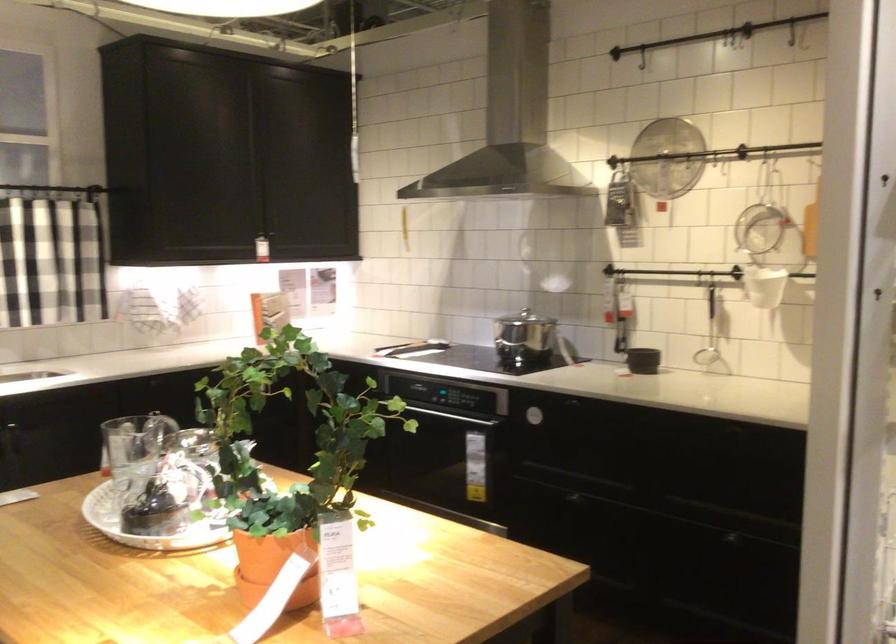
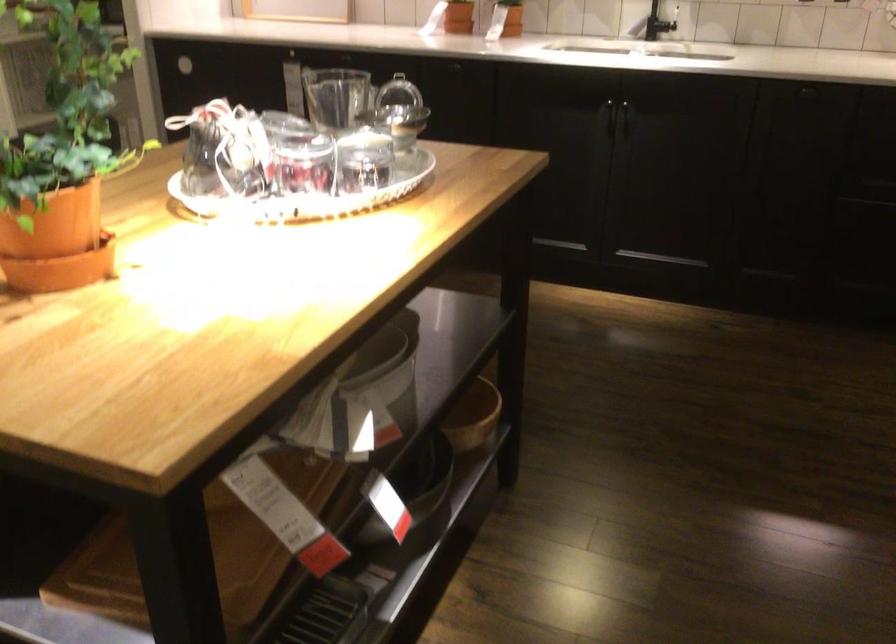
The point at (328,554) is marked in the first image. Where is the corresponding point in the second image?

(57, 239)